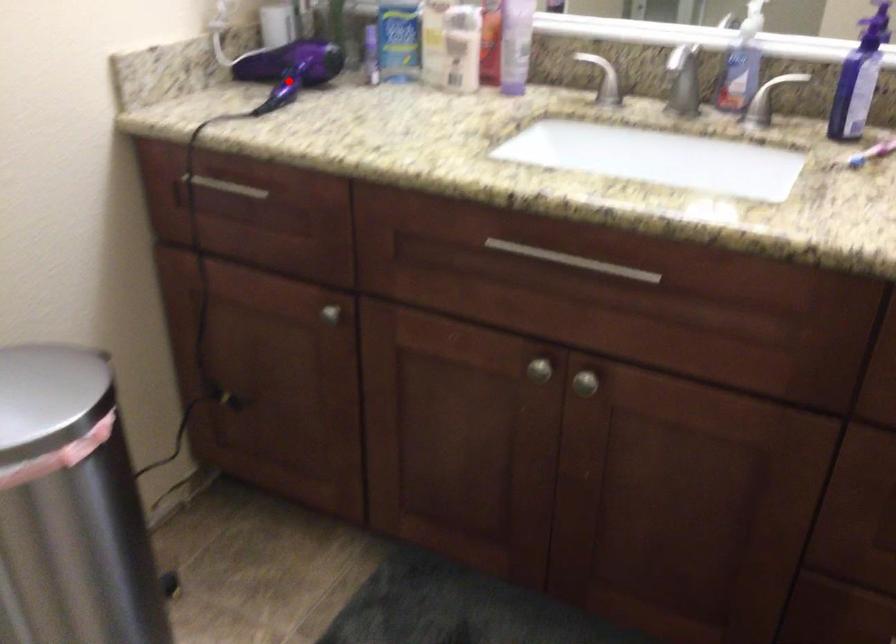
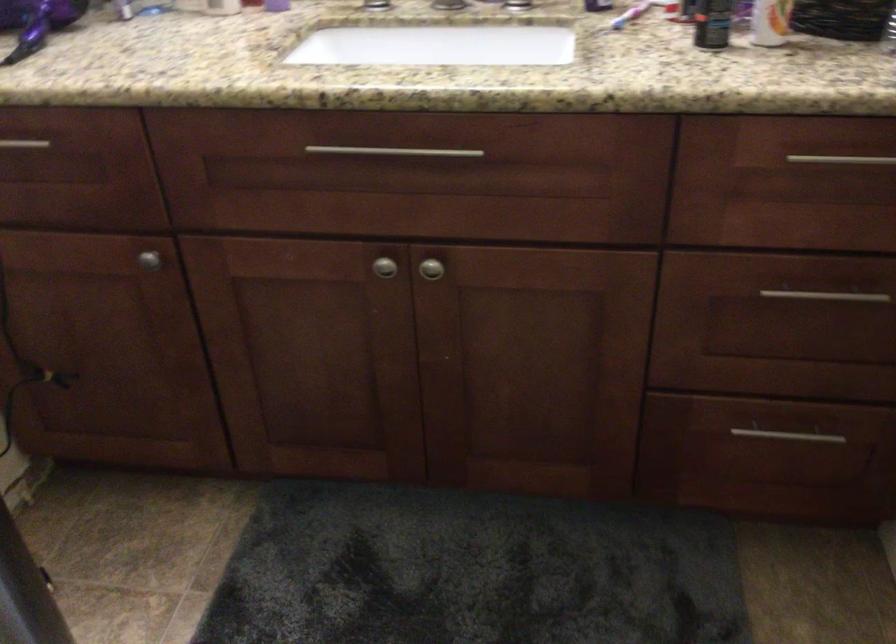
Question: I am providing you with two images of the same scene from different viewpoints. A red point is marked on the first image. At the location where the point appears in image 1, is it still visible in image 2?

Choices:
 (A) Yes
 (B) No

Answer: (A)